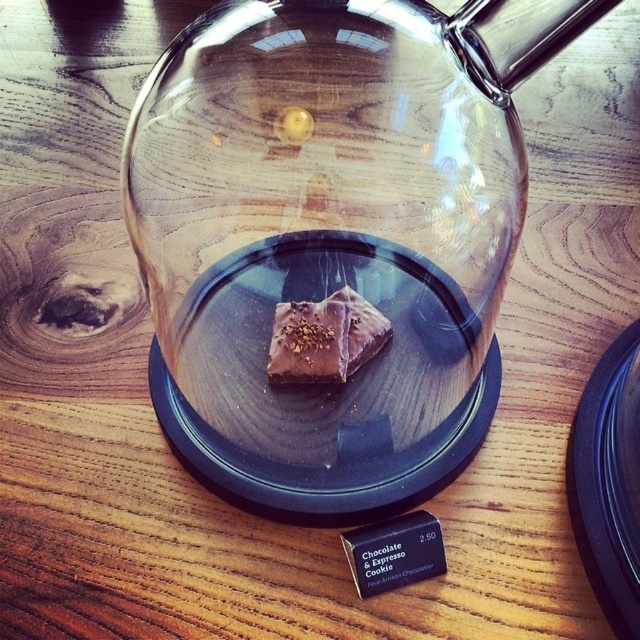
Does point (164, 218) come farther from viewer compared to point (420, 544)?

No, it is in front of (420, 544).

Which is in front, point (280, 227) or point (378, 550)?

Positioned in front is point (280, 227).

Between point (497, 180) and point (417, 532), which one is positioned behind?

Positioned behind is point (417, 532).

Identify the location of transparent glass teapot at center. (332, 234).

Is transparent glass teapot at center below black glossy plate at bottom right?

No.

Is point (451, 291) more distant than point (604, 486)?

That is False.

Locate an element on the screen. Image resolution: width=640 pixels, height=640 pixels. transparent glass teapot at center is located at coordinates (332, 234).

Who is higher up, transparent glass teapot at center or chocolatesmoothsquare at center?

transparent glass teapot at center is higher up.

From the picture: Can you confirm if transparent glass teapot at center is positioned to the right of chocolatesmoothsquare at center?

Indeed, transparent glass teapot at center is positioned on the right side of chocolatesmoothsquare at center.

Does point (452, 161) lie behind point (349, 321)?

No.

Locate an element on the screen. Image resolution: width=640 pixels, height=640 pixels. transparent glass teapot at center is located at coordinates (332, 234).